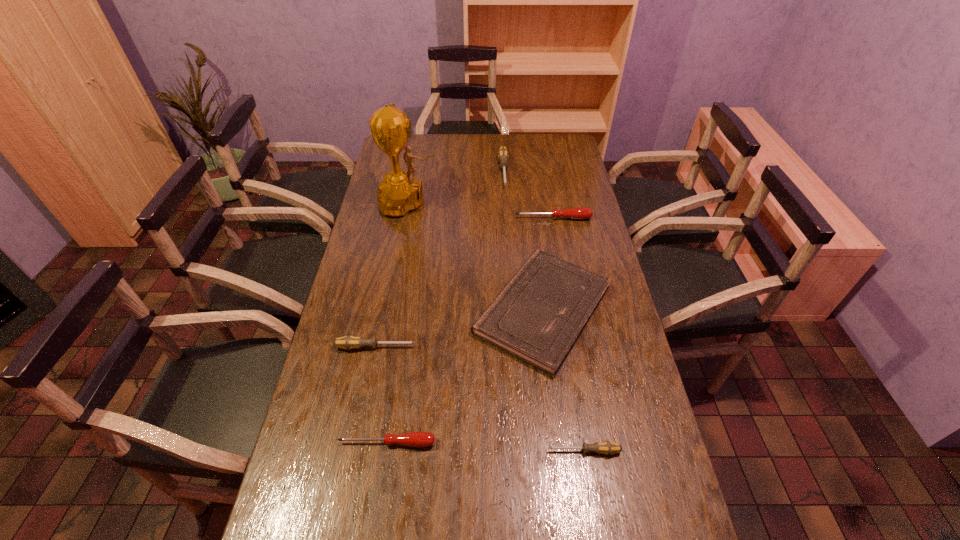
Find the location of `free space between the bigger red screwdriver and the farthest screwdriver`. free space between the bigger red screwdriver and the farthest screwdriver is located at coordinates (528, 195).

Where is `vacant point located between the tallest object and the paperback book`? vacant point located between the tallest object and the paperback book is located at coordinates (477, 256).

This screenshot has height=540, width=960. In order to click on object that is the fifth closest to the farthest gray screwdriver in this screenshot , I will do `click(419, 439)`.

This screenshot has width=960, height=540. Find the location of `object identified as the fourth closest to the smallest gray screwdriver`. object identified as the fourth closest to the smallest gray screwdriver is located at coordinates (579, 213).

You are a GUI agent. You are given a task and a screenshot of the screen. Output one action in this format:
    pyautogui.click(x=<x>, y=<y>)
    Task: Click on the screwdriver identified as the fourth closest to the paperback book
    This screenshot has height=540, width=960.
    Given the screenshot: What is the action you would take?
    point(579,213)

The image size is (960, 540). In order to click on screwdriver that is the fourth closest one to the shortest screwdriver in this screenshot , I will do `click(503, 154)`.

Identify which gray screwdriver is located as the second nearest to the tallest object. Please provide its 2D coordinates. Your answer should be formatted as a tuple, i.e. [(x, y)], where the tuple contains the x and y coordinates of a point satisfying the conditions above.

[(349, 342)]

Identify which gray screwdriver is the closest to the shortest object. Please provide its 2D coordinates. Your answer should be formatted as a tuple, i.e. [(x, y)], where the tuple contains the x and y coordinates of a point satisfying the conditions above.

[(349, 342)]

Identify which red screwdriver is the second closest to the gold award. Please provide its 2D coordinates. Your answer should be formatted as a tuple, i.e. [(x, y)], where the tuple contains the x and y coordinates of a point satisfying the conditions above.

[(419, 439)]

You are a GUI agent. You are given a task and a screenshot of the screen. Output one action in this format:
    pyautogui.click(x=<x>, y=<y>)
    Task: Click on the red screwdriver identified as the second closest to the gold award
    The width and height of the screenshot is (960, 540).
    Given the screenshot: What is the action you would take?
    pyautogui.click(x=419, y=439)